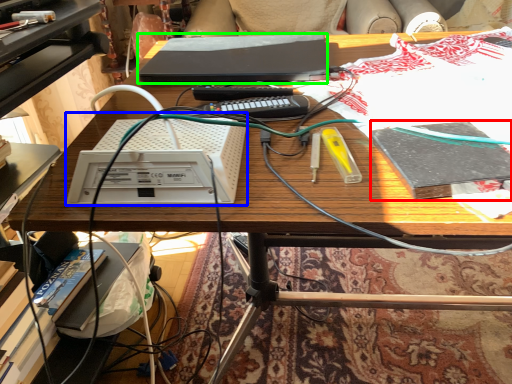
Question: Estimate the real-world distances between objects in this image. Which object is farther from book (highlighted by a red box), equipment (highlighted by a blue box) or computer (highlighted by a green box)?

Choices:
 (A) equipment
 (B) computer

Answer: (B)